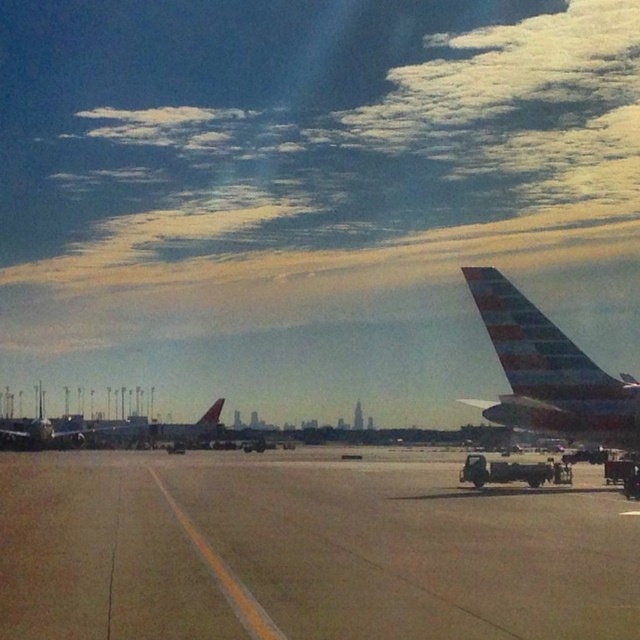
Who is positioned more to the right, polished aluminum airplane wing at right or metallic silver airplane at left?

polished aluminum airplane wing at right

Is the position of polished aluminum airplane wing at right more distant than that of metallic silver airplane at left?

No.

Locate an element on the screen. polished aluminum airplane wing at right is located at coordinates point(548,372).

Locate an element on the screen. This screenshot has height=640, width=640. polished aluminum airplane wing at right is located at coordinates (548, 372).

Who is more distant from viewer, (140, 636) or (480, 307)?

The point (480, 307) is more distant.

Which is more to the right, concrete tarmac at center or polished aluminum airplane wing at right?

From the viewer's perspective, polished aluminum airplane wing at right appears more on the right side.

Between point (20, 579) and point (518, 381), which one is positioned behind?

Point (518, 381)

Locate an element on the screen. The width and height of the screenshot is (640, 640). concrete tarmac at center is located at coordinates (304, 554).

Is point (163, 595) positioned after point (48, 438)?

No, (163, 595) is closer to viewer.

Which is in front, point (273, 541) or point (67, 435)?

Point (273, 541)

Where is `concrete tarmac at center`? The image size is (640, 640). concrete tarmac at center is located at coordinates (304, 554).